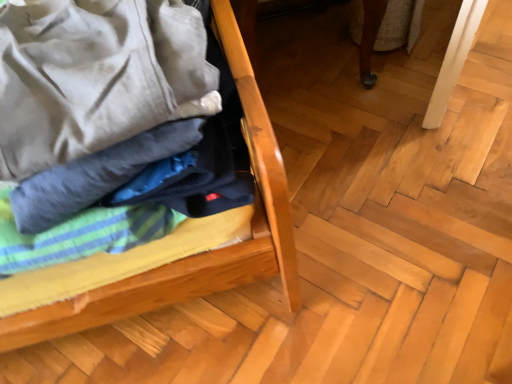
Locate an element on the screen. wooden bed frame at left is located at coordinates [x=196, y=254].

This screenshot has width=512, height=384. Describe the element at coordinates (196, 254) in the screenshot. I see `wooden bed frame at left` at that location.

I want to click on wooden bed frame at left, so click(196, 254).